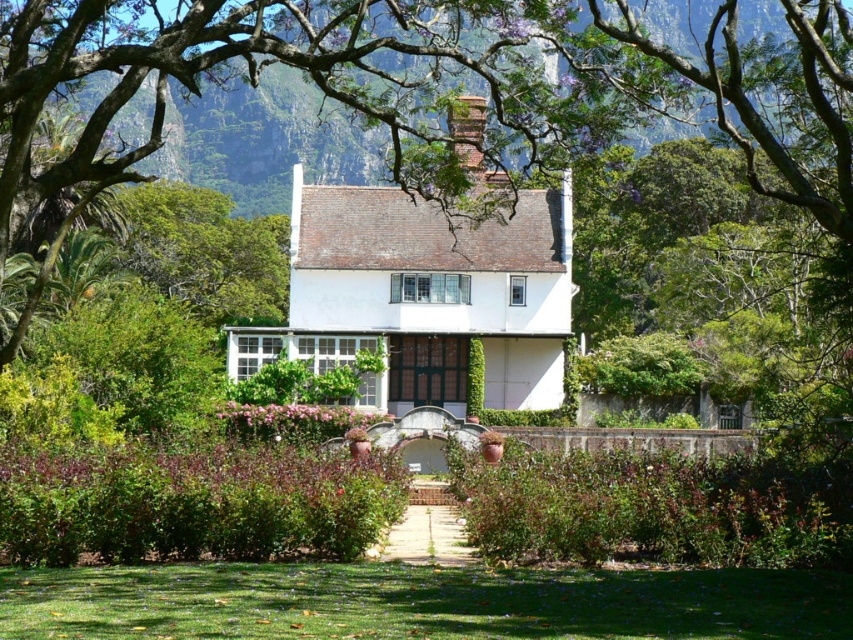
Question: Does green leafy tree at upper center have a lesser width compared to brick chimney at center?

Choices:
 (A) yes
 (B) no

Answer: (B)

Question: Is green grass at lower center to the right of brick chimney at center from the viewer's perspective?

Choices:
 (A) yes
 (B) no

Answer: (B)

Question: Does green leafy tree at upper center appear on the right side of brick chimney at center?

Choices:
 (A) yes
 (B) no

Answer: (B)

Question: Which point appears closest to the camera in this image?

Choices:
 (A) (769, 154)
 (B) (392, 611)

Answer: (B)

Question: Which object appears closest to the camera in this image?

Choices:
 (A) green grass at lower center
 (B) green leafy tree at upper center

Answer: (A)

Question: Which of the following is the closest to the observer?

Choices:
 (A) green grass at lower center
 (B) green leafy tree at upper center

Answer: (A)